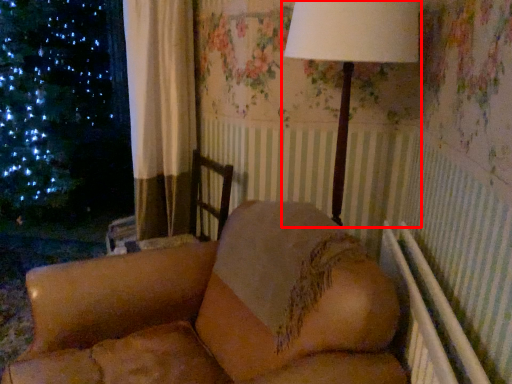
Question: In this image, where is lamp (annotated by the red box) located relative to furniture?

Choices:
 (A) left
 (B) right

Answer: (B)